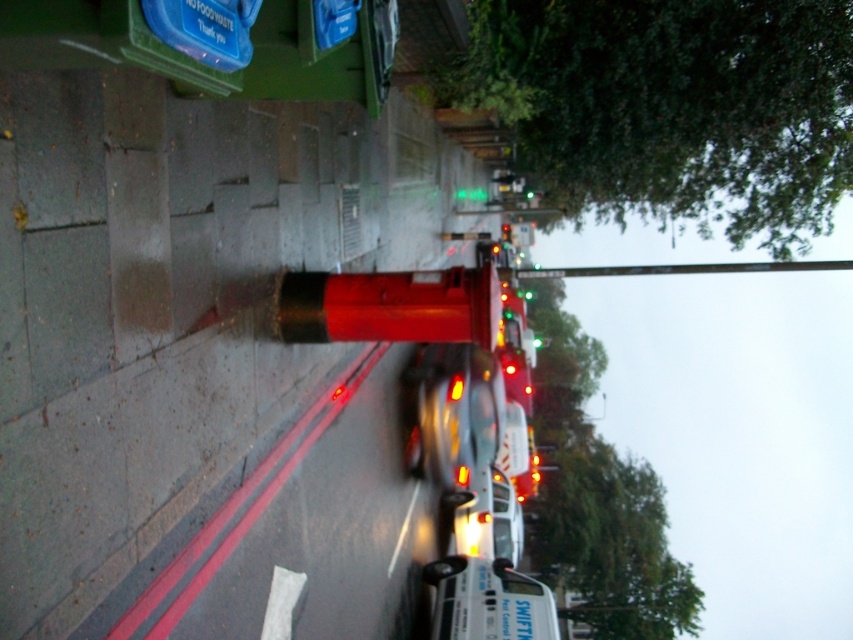
Which is below, white glossy van at center or green glass traffic light at center?

Positioned lower is white glossy van at center.

How distant is white glossy van at center from green glass traffic light at center?

white glossy van at center is 27.92 meters away from green glass traffic light at center.

Does point (525, 618) come behind point (509, 236)?

No, it is not.

Identify the location of white glossy van at center. This screenshot has width=853, height=640. (488, 602).

Who is taller, white glossy car at center or green glass traffic light at center?

Standing taller between the two is white glossy car at center.

Is point (465, 518) less distant than point (503, 228)?

That is True.

Locate an element on the screen. The width and height of the screenshot is (853, 640). white glossy car at center is located at coordinates (486, 518).

Is shiny silver car at center thinner than green glass traffic light at center?

No.

Can you confirm if shiny silver car at center is taller than green glass traffic light at center?

Correct, shiny silver car at center is much taller as green glass traffic light at center.

Is point (405, 461) positioned after point (503, 224)?

No.

Locate an element on the screen. The height and width of the screenshot is (640, 853). shiny silver car at center is located at coordinates (453, 412).